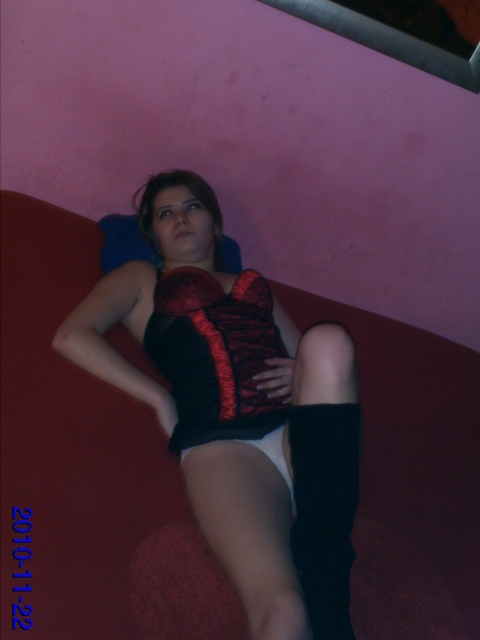
You are an interior designer planning to place a new lamp in the living room. The lamp requires a specific location at point (x=238, y=410). Is there an object at that point that might interfere with placing the lamp?

Yes, the black satin corset at center is located at point (x=238, y=410), which would interfere with placing the lamp there.

You are a photographer adjusting the lighting in the room. You notice a point at coordinates (215, 355). What object is this point located on?

The point at coordinates (215, 355) is located on the black lace corset at center.

Based on the photo, you are a fashion designer trying to decide which corset to feature in your new collection. You have two options in the image, the black satin corset at center and the black lace corset at center. Which one is bigger in size?

The black satin corset at center has a larger size compared to the black lace corset at center, so the black satin corset at center is bigger in size.